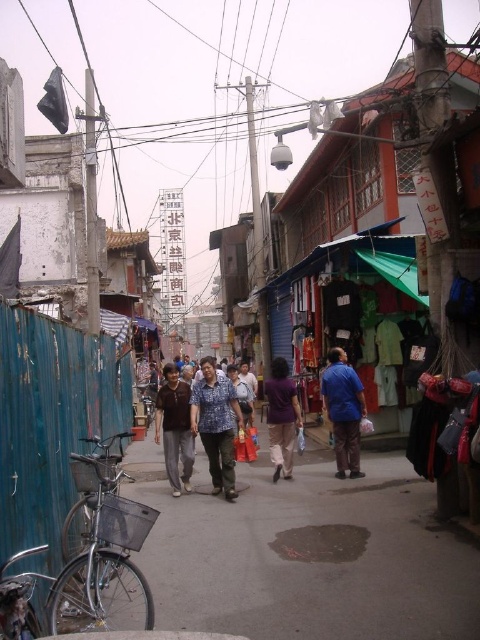
You are a tailor who needs to determine which shirt requires more fabric based on their widths. Given the brown matte shirt at center and the purple matte shirt at center, which one would need more fabric?

The brown matte shirt at center requires more fabric because its width surpasses that of the purple matte shirt at center.

Looking at this image, you are a street vendor in this busy area and need to choose between two shirts displayed at the center of the scene. The shirts are labeled as the brown matte shirt at center and the purple matte shirt at center. Which shirt has a larger size?

The brown matte shirt at center is bigger than the purple matte shirt at center, so the brown matte shirt at center has a larger size.

You are standing at the point with coordinates point (x=180, y=381) and want to walk towards the point with coordinates point (x=358, y=410). Given the narrow street and parked bicycles along the left side, will you have to walk around any obstacles to reach your destination?

Point (x=358, y=410) is in front of point (x=180, y=381), so you can walk straight towards it without needing to go around any obstacles.